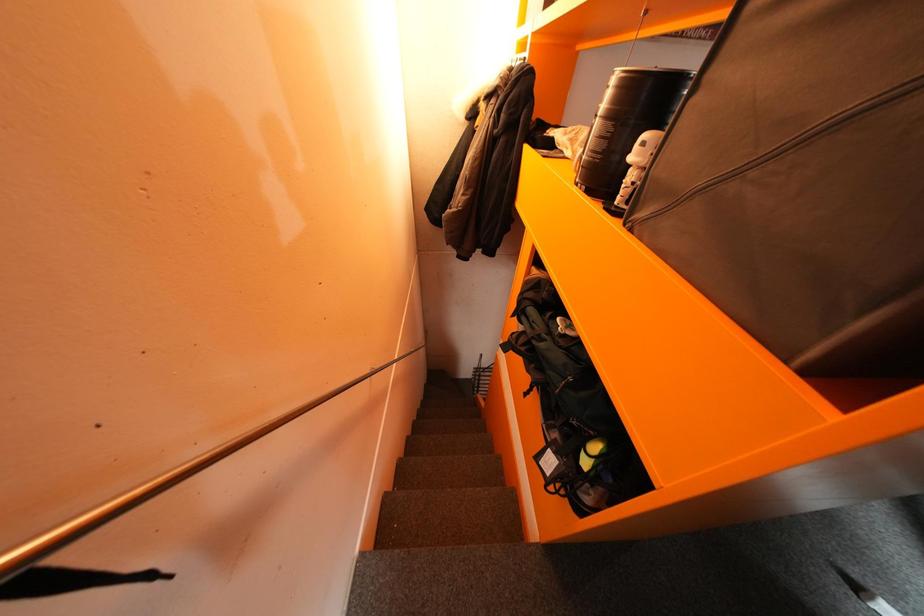
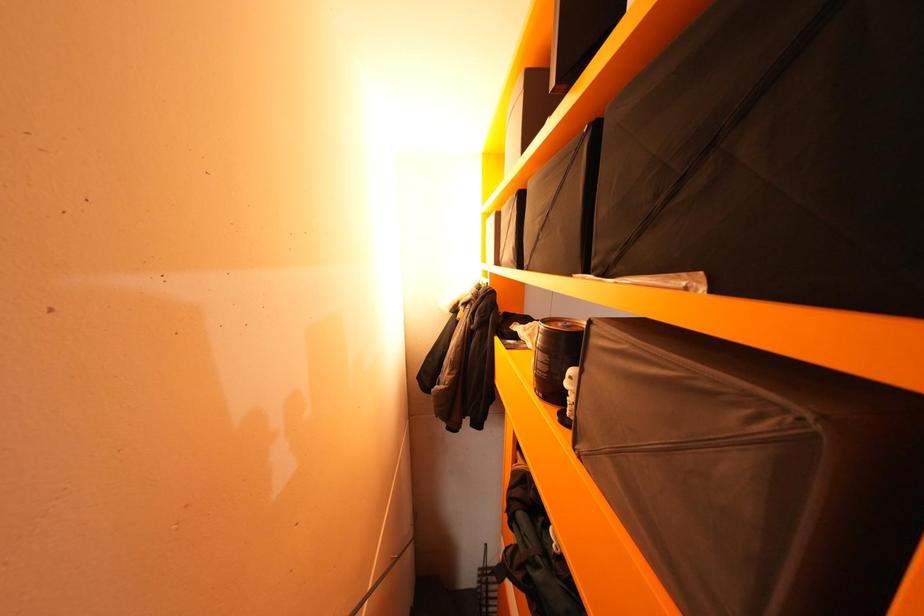
Question: The images are taken continuously from a first-person perspective. In which direction is your viewpoint rotating?

Choices:
 (A) Left
 (B) Right
 (C) Up
 (D) Down

Answer: (C)